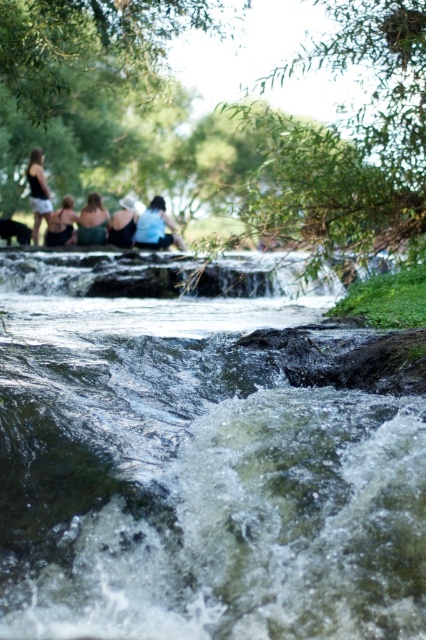
Question: Considering the real-world distances, which object is closest to the white frothy water at center?

Choices:
 (A) matte black tank top at left
 (B) matte green tank top at center
 (C) matte black tank top at upper left
 (D) blue fabric shirt at center

Answer: (D)

Question: Can you confirm if blue fabric shirt at center is positioned to the left of matte black tank top at left?

Choices:
 (A) no
 (B) yes

Answer: (A)

Question: Which of the following is the closest to the observer?

Choices:
 (A) (86, 240)
 (B) (32, 205)

Answer: (A)

Question: Which object is closer to the camera taking this photo?

Choices:
 (A) matte black tank top at upper left
 (B) matte blue tank top at center
 (C) white frothy water at center

Answer: (C)

Question: Can you confirm if white frothy water at center is thinner than matte blue tank top at center?

Choices:
 (A) no
 (B) yes

Answer: (B)

Question: Does matte black tank top at upper left have a larger size compared to matte blue tank top at center?

Choices:
 (A) yes
 (B) no

Answer: (A)